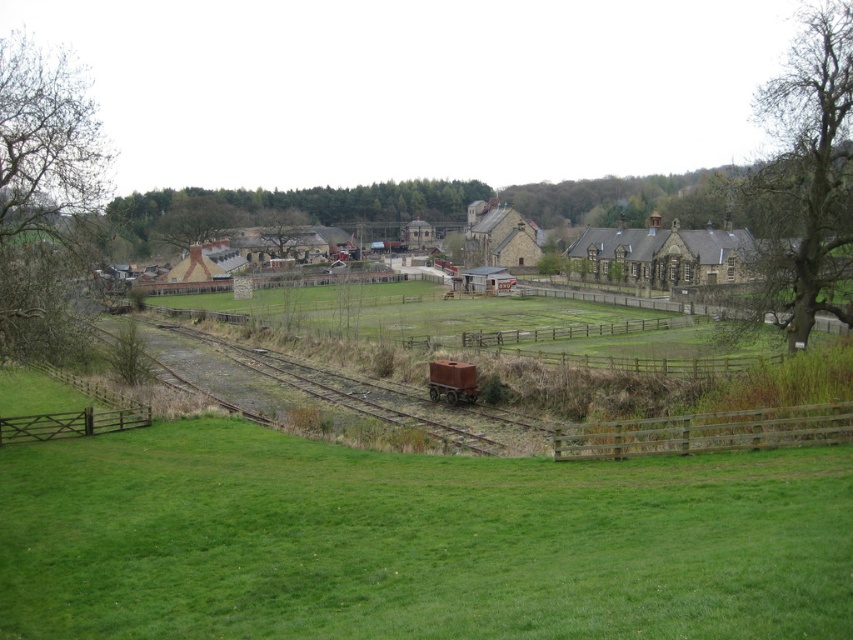
Question: Which of the following is the closest to the observer?

Choices:
 (A) green leafy tree at center
 (B) brown wooden fence at lower left

Answer: (B)

Question: Is green grassy field at center to the right of green leafy tree at center from the viewer's perspective?

Choices:
 (A) yes
 (B) no

Answer: (A)

Question: Can you confirm if bare branches at left is positioned below wooden fence at lower right?

Choices:
 (A) no
 (B) yes

Answer: (A)

Question: Which object is closer to the camera taking this photo?

Choices:
 (A) wooden fence at lower right
 (B) brown wooden fence at lower left
 (C) green grassy field at center

Answer: (C)

Question: Estimate the real-world distances between objects in this image. Which object is closer to the green grassy field at center?

Choices:
 (A) bare branches at left
 (B) brown wooden fence at lower left
 (C) wooden fence at lower right

Answer: (C)

Question: Does green grassy field at center appear under wooden fence at lower right?

Choices:
 (A) no
 (B) yes

Answer: (B)